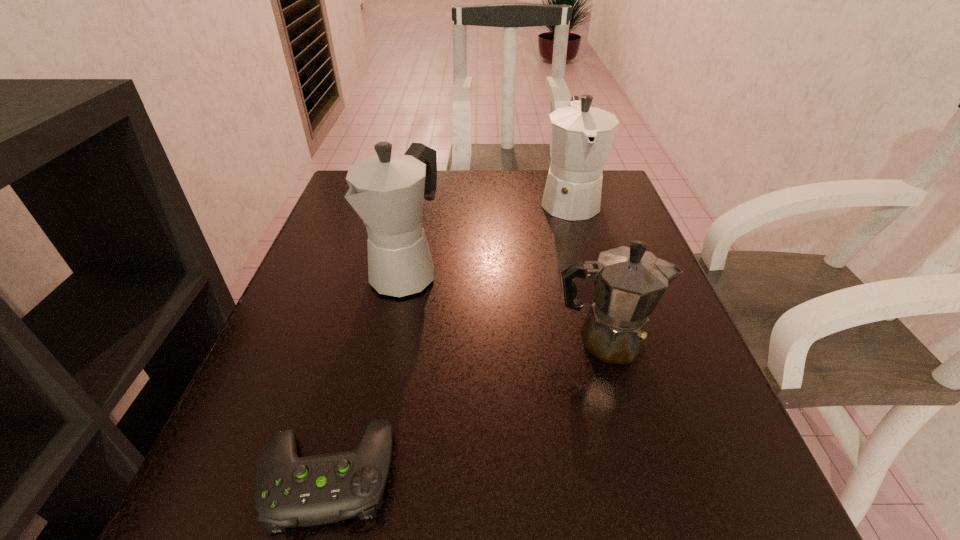
The height and width of the screenshot is (540, 960). In the image, there is a desktop. Identify the location of vacant space at the far right corner. (622, 195).

This screenshot has height=540, width=960. What are the coordinates of `free space that is in between the third tallest object and the shortest object` in the screenshot? It's located at (467, 407).

The image size is (960, 540). I want to click on vacant area that lies between the third tallest object and the leftmost coffeepot, so click(x=505, y=306).

Identify the location of unoccupied position between the nearest object and the shortest coffeepot. (467, 407).

You are a GUI agent. You are given a task and a screenshot of the screen. Output one action in this format:
    pyautogui.click(x=<x>, y=<y>)
    Task: Click on the free point between the shortest coffeepot and the control
    The height and width of the screenshot is (540, 960).
    Given the screenshot: What is the action you would take?
    pyautogui.click(x=467, y=407)

Locate an element on the screen. empty location between the leftmost coffeepot and the shortest object is located at coordinates (367, 374).

At what (x,y) coordinates should I click in order to perform the action: click on empty space that is in between the second farthest object and the nearest coffeepot. Please return your answer as a coordinate pair (x, y). Looking at the image, I should click on (505, 306).

You are a GUI agent. You are given a task and a screenshot of the screen. Output one action in this format:
    pyautogui.click(x=<x>, y=<y>)
    Task: Click on the vacant area that lies between the nearest object and the farthest coffeepot
    
    Given the screenshot: What is the action you would take?
    pyautogui.click(x=448, y=338)

Locate an element on the screen. unoccupied position between the control and the second farthest object is located at coordinates (367, 374).

Locate an element on the screen. object that is the second closest one to the shortest object is located at coordinates (628, 281).